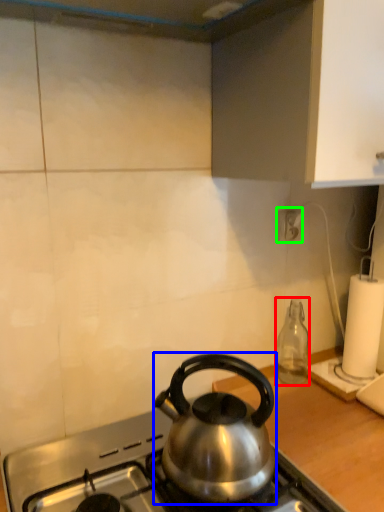
Question: Which is farther away from bottle (highlighted by a red box)? kettle (highlighted by a blue box) or power outlet (highlighted by a green box)?

Choices:
 (A) kettle
 (B) power outlet

Answer: (A)